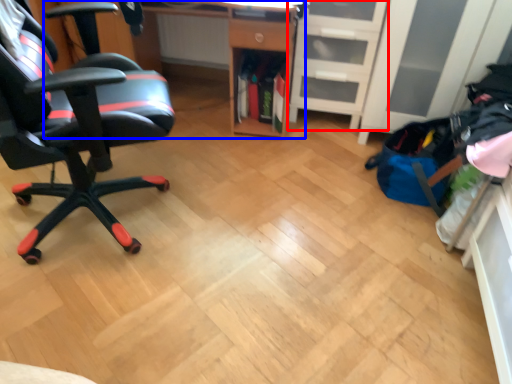
Question: Among these objects, which one is nearest to the camera, file cabinet (highlighted by a red box) or desk (highlighted by a blue box)?

Choices:
 (A) file cabinet
 (B) desk

Answer: (B)